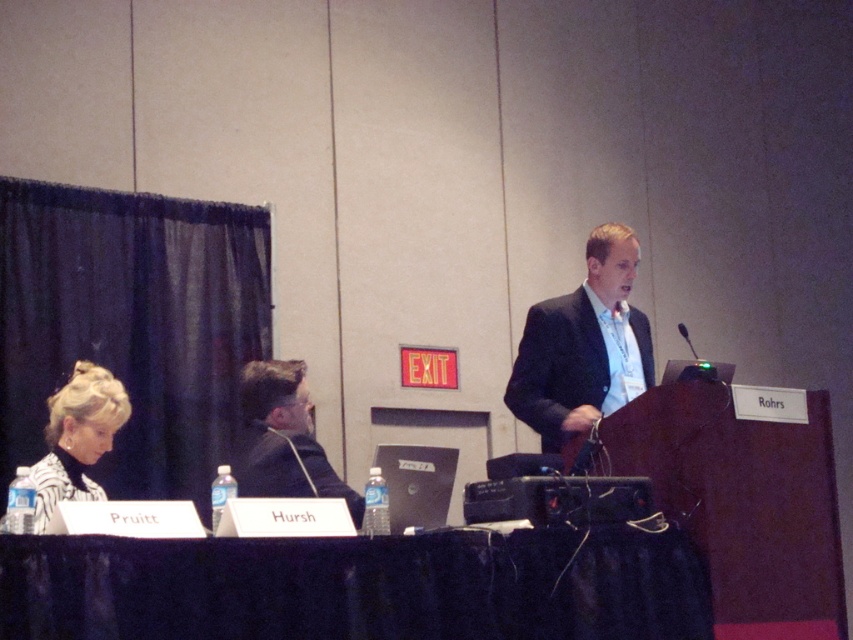
From the picture: Is dark suit at center wider than black plastic microphone at upper center?

Yes, dark suit at center is wider than black plastic microphone at upper center.

Is point (323, 496) farther from camera compared to point (685, 326)?

No, (323, 496) is in front of (685, 326).

Where is `dark suit at center`? dark suit at center is located at coordinates (283, 438).

Is matte black suit at center above dark suit at center?

Yes, matte black suit at center is above dark suit at center.

Consider the image. Can you confirm if matte black suit at center is thinner than dark suit at center?

In fact, matte black suit at center might be wider than dark suit at center.

What do you see at coordinates (582, 346) in the screenshot? The height and width of the screenshot is (640, 853). I see `matte black suit at center` at bounding box center [582, 346].

What are the coordinates of `matte black suit at center` in the screenshot? It's located at (582, 346).

Is the position of black fabric table at lower center more distant than that of black plastic microphone at upper center?

No.

Which is in front, point (482, 586) or point (686, 339)?

Point (482, 586) is in front.

Locate an element on the screen. The image size is (853, 640). black fabric table at lower center is located at coordinates point(357,586).